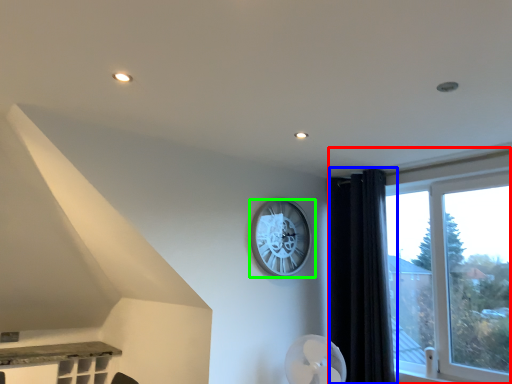
Question: Which object is positioned farthest from window (highlighted by a red box)? Select from curtain (highlighted by a blue box) and wall clock (highlighted by a green box).

Choices:
 (A) curtain
 (B) wall clock

Answer: (B)